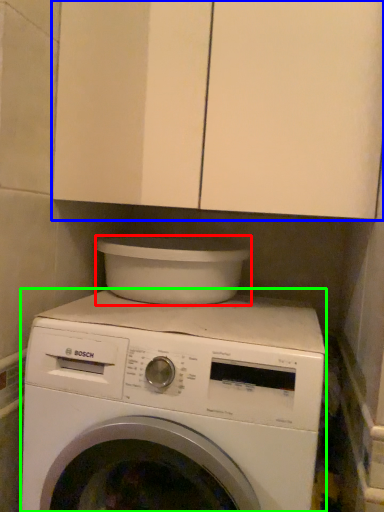
Question: Based on their relative distances, which object is farther from appliance (highlighted by a red box)? Choose from cabinetry (highlighted by a blue box) and washing machine (highlighted by a green box).

Choices:
 (A) cabinetry
 (B) washing machine

Answer: (A)